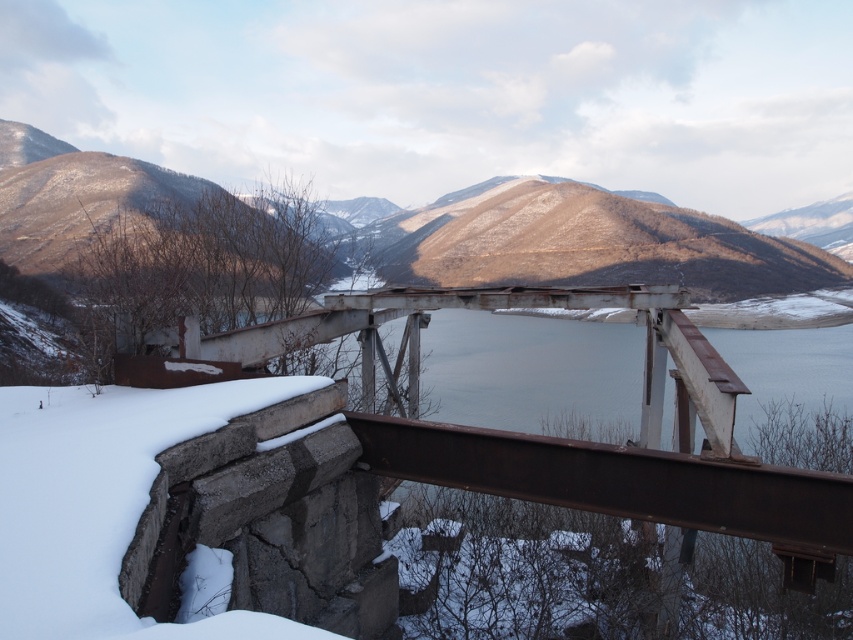
Question: Does rusty metal bridge at center have a larger size compared to brown textured mountain at center?

Choices:
 (A) no
 (B) yes

Answer: (A)

Question: Is rusty metal bridge at center thinner than brown textured mountain at center?

Choices:
 (A) yes
 (B) no

Answer: (A)

Question: Which object is closer to the camera taking this photo?

Choices:
 (A) rusty metal bridge at center
 (B) brown textured mountain at center

Answer: (A)

Question: Is rusty metal bridge at center above brown textured mountain at center?

Choices:
 (A) no
 (B) yes

Answer: (A)